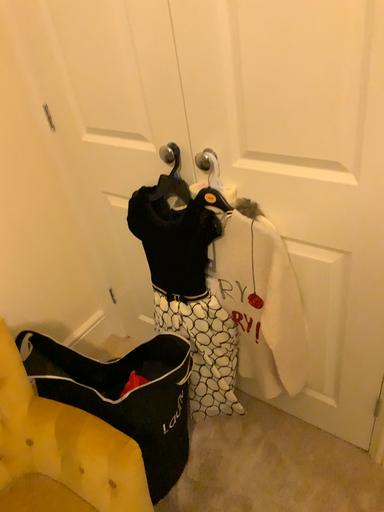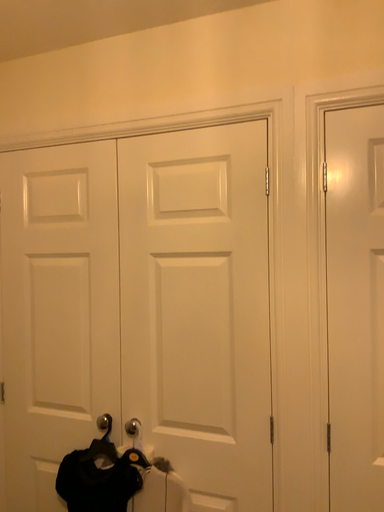
Question: How did the camera likely rotate when shooting the video?

Choices:
 (A) rotated downward
 (B) rotated upward

Answer: (B)